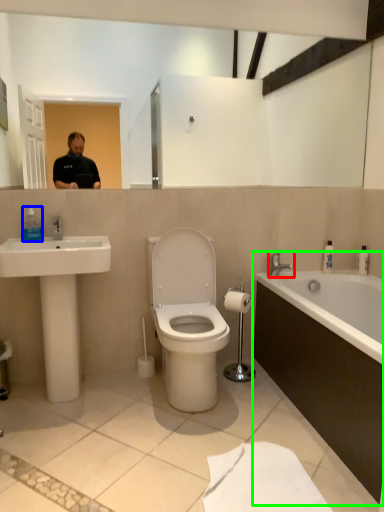
Question: Estimate the real-world distances between objects in this image. Which object is closer to tap (highlighted by a red box), soap dispenser (highlighted by a blue box) or bathtub (highlighted by a green box)?

Choices:
 (A) soap dispenser
 (B) bathtub

Answer: (B)